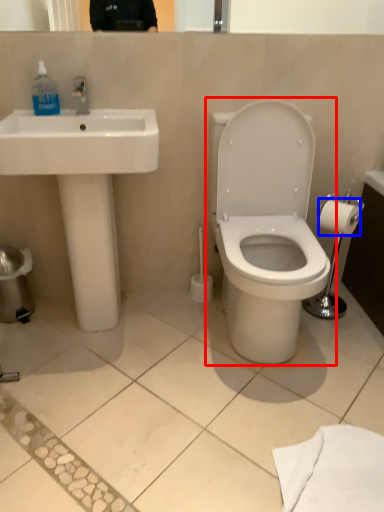
Question: Which object appears farthest to the camera in this image, toilet (highlighted by a red box) or toilet paper (highlighted by a blue box)?

Choices:
 (A) toilet
 (B) toilet paper

Answer: (B)